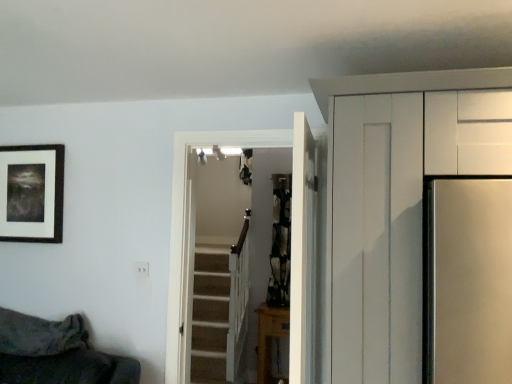
Question: Is black matte picture frame at upper left smaller than wooden table at lower center?

Choices:
 (A) yes
 (B) no

Answer: (A)

Question: From the image's perspective, does black matte picture frame at upper left appear lower than wooden table at lower center?

Choices:
 (A) no
 (B) yes

Answer: (A)

Question: From a real-world perspective, is black matte picture frame at upper left on top of wooden table at lower center?

Choices:
 (A) yes
 (B) no

Answer: (A)

Question: Is wooden table at lower center surrounded by black matte picture frame at upper left?

Choices:
 (A) yes
 (B) no

Answer: (B)

Question: Is black matte picture frame at upper left completely or partially outside of wooden table at lower center?

Choices:
 (A) yes
 (B) no

Answer: (A)

Question: Is wooden table at lower center to the left or to the right of white wooden door at center, acting as the first door starting from the back, in the image?

Choices:
 (A) right
 (B) left

Answer: (A)

Question: Is wooden table at lower center inside the boundaries of white wooden door at center, acting as the first door starting from the back, or outside?

Choices:
 (A) outside
 (B) inside

Answer: (A)

Question: From a real-world perspective, is wooden table at lower center positioned above or below white wooden door at center, acting as the first door starting from the back?

Choices:
 (A) above
 (B) below

Answer: (B)

Question: Considering their positions, is wooden table at lower center located in front of or behind white wooden door at center, the second door from the front?

Choices:
 (A) front
 (B) behind

Answer: (B)

Question: Considering their positions, is white wooden door at center, the 1th door viewed from the front, located in front of or behind black matte picture frame at upper left?

Choices:
 (A) front
 (B) behind

Answer: (A)

Question: Which is correct: white wooden door at center, the 1th door viewed from the front, is inside black matte picture frame at upper left, or outside of it?

Choices:
 (A) inside
 (B) outside

Answer: (B)

Question: From the image's perspective, is white wooden door at center, the 1th door viewed from the front, above or below black matte picture frame at upper left?

Choices:
 (A) below
 (B) above

Answer: (A)

Question: Considering the positions of white wooden door at center, the second door when ordered from back to front, and black matte picture frame at upper left in the image, is white wooden door at center, the second door when ordered from back to front, bigger or smaller than black matte picture frame at upper left?

Choices:
 (A) big
 (B) small

Answer: (A)

Question: Considering the positions of point (290, 145) and point (301, 140), is point (290, 145) closer or farther from the camera than point (301, 140)?

Choices:
 (A) farther
 (B) closer

Answer: (A)

Question: From the image's perspective, is white wooden door at center, the second door from the front, located above or below white wooden door at center, the 1th door viewed from the front?

Choices:
 (A) below
 (B) above

Answer: (A)